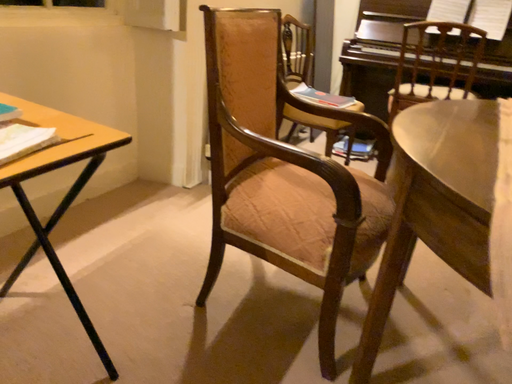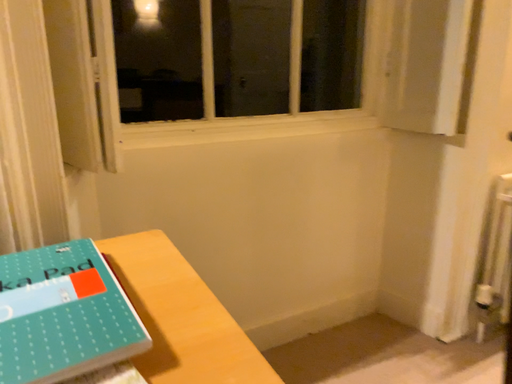
Question: Which way did the camera rotate in the video?

Choices:
 (A) rotated upward
 (B) rotated downward

Answer: (A)